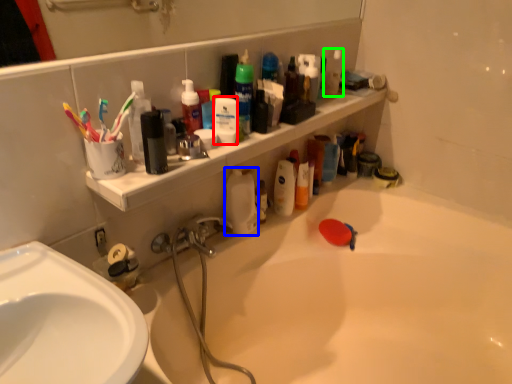
Question: Based on their relative distances, which object is nearer to cleaning product (highlighted by a red box)? Choose from cleaning product (highlighted by a blue box) and cleaning product (highlighted by a green box).

Choices:
 (A) cleaning product
 (B) cleaning product

Answer: (A)